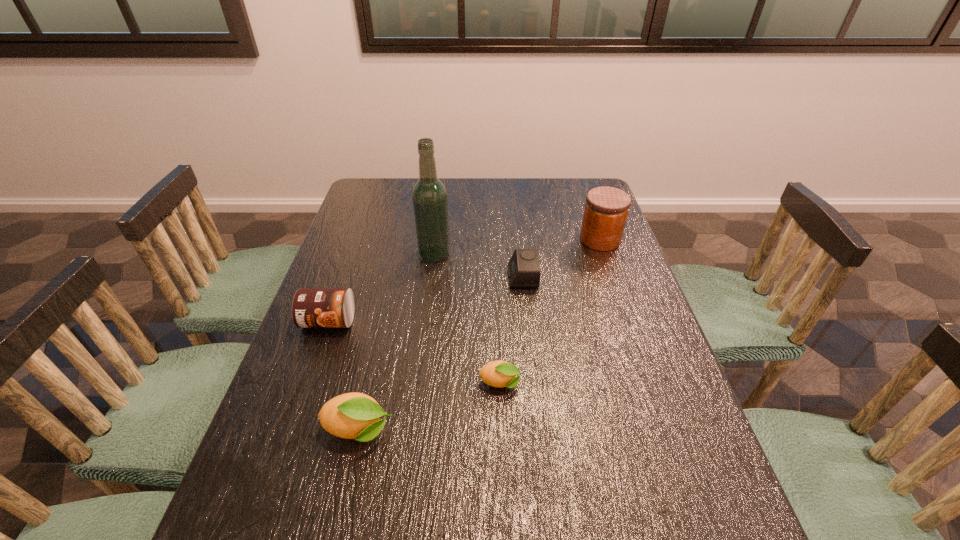
The image size is (960, 540). I want to click on the left lemon, so click(x=357, y=416).

The image size is (960, 540). I want to click on the taller lemon, so click(x=357, y=416).

Locate an element on the screen. The width and height of the screenshot is (960, 540). the shorter lemon is located at coordinates pyautogui.click(x=499, y=373).

Identify the location of the second nearest object. The height and width of the screenshot is (540, 960). (499, 373).

Where is `liquor`? liquor is located at coordinates (430, 200).

Where is `the fifth shortest object`? This screenshot has height=540, width=960. the fifth shortest object is located at coordinates (606, 209).

I want to click on the rightmost object, so click(606, 209).

Image resolution: width=960 pixels, height=540 pixels. Find the location of `the leftmost object`. the leftmost object is located at coordinates (312, 307).

This screenshot has height=540, width=960. In order to click on the third nearest object in this screenshot , I will do `click(312, 307)`.

At what (x,y) coordinates should I click in order to perform the action: click on the fourth nearest object. Please return your answer as a coordinate pair (x, y). Looking at the image, I should click on (524, 270).